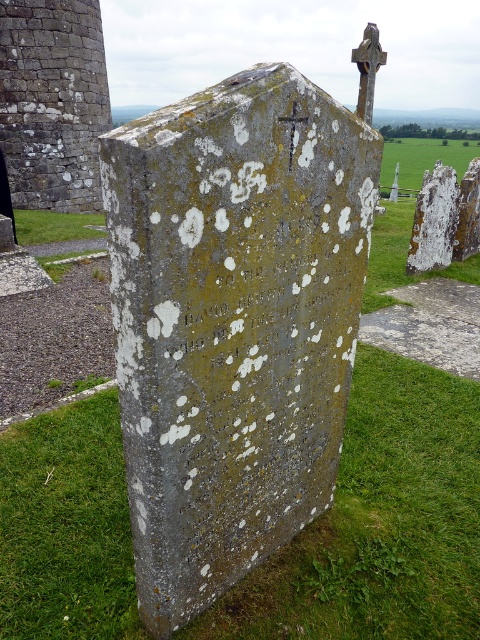
You are a landscape architect designing a new cemetery layout. You need to place a new pathway between the speckled stone gravestone at center and the green grass at upper center. Which side of the pathway should be closer to the gravestone to ensure it aligns with the existing cemetery aesthetics?

The speckled stone gravestone at center is narrower than the green grass at upper center, so the pathway should be placed closer to the gravestone to maintain proportional spacing between them.

Based on the photo, you are standing in a cemetery and want to place a wreath on the speckled stone gravestone at center. There is green grass at upper center nearby. Which object is closer to you where you can reach it first?

The speckled stone gravestone at center is closer to the viewer than the green grass at upper center, so you can reach the speckled stone gravestone at center first.